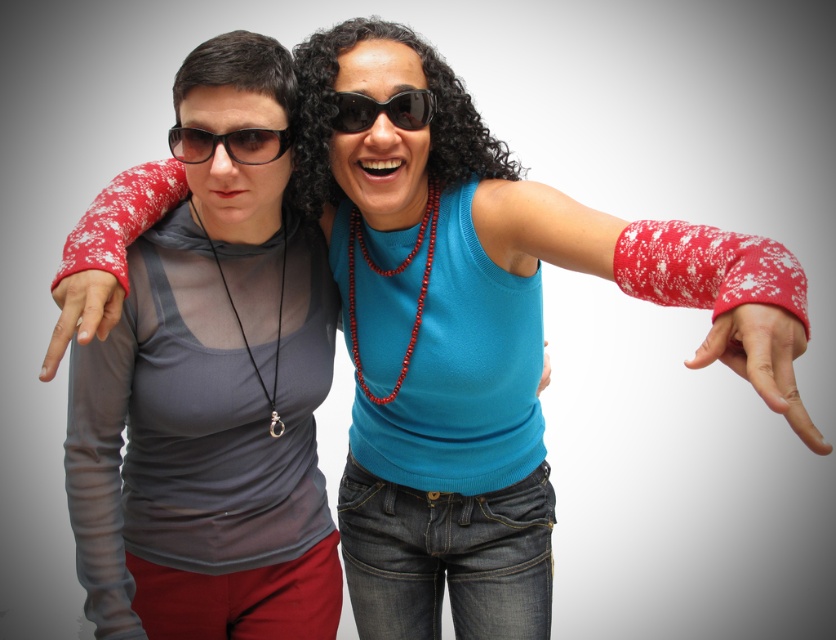
Question: Is matte black sunglasses at upper left below red knitted wrist warmer at lower right?

Choices:
 (A) yes
 (B) no

Answer: (B)

Question: Which object is the closest to the matte black sunglasses at upper left?

Choices:
 (A) red knitted wrist warmer at lower right
 (B) red knitted arm warmer at left

Answer: (B)

Question: Considering the real-world distances, which object is farthest from the matte red sweater at left?

Choices:
 (A) red knitted wristband at lower right
 (B) black plastic sunglasses at center
 (C) red knitted arm warmer at left
 (D) matte gray tank top at left

Answer: (A)

Question: Which object appears closest to the camera in this image?

Choices:
 (A) matte red sweater at left
 (B) matte gray tank top at left
 (C) red knitted wrist warmer at lower right

Answer: (A)

Question: Can you confirm if red knitted wrist warmer at right is thinner than red knitted arm warmer at left?

Choices:
 (A) yes
 (B) no

Answer: (B)

Question: Is red knitted wrist warmer at right to the left of black plastic sunglasses at center from the viewer's perspective?

Choices:
 (A) no
 (B) yes

Answer: (A)